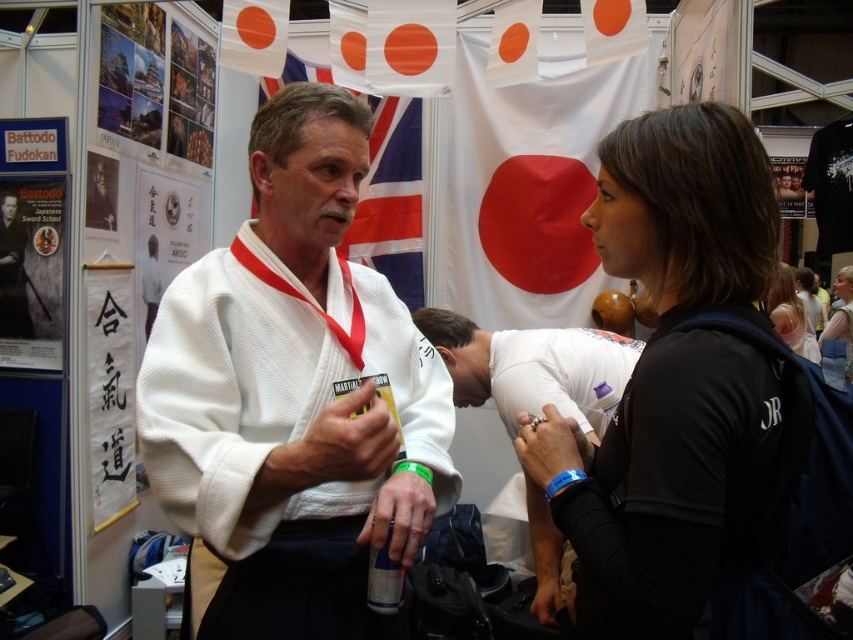
You are an event organizer at the martial arts exhibition. You need to arrange the black matte jacket at center and the white matte kimono at center so that they are displayed properly. Based on their current positions, which item is placed higher on the display rack?

The black matte jacket at center is above the white matte kimono at center, so it is placed higher on the display rack.

From the picture: Based on the scene described, what is located at the coordinates point (672,378)?

The coordinates point (672,378) indicate the location of the black matte jacket at center.